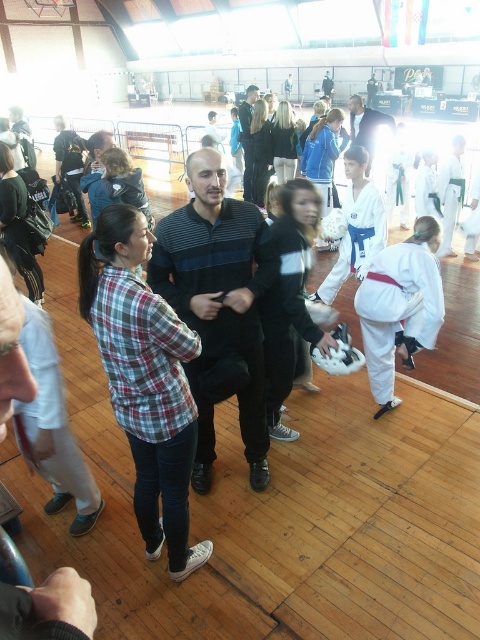
You are a photographer positioned at the back of the gymnasium. You want to take a photo that includes both the striped sweater at center and the matte black jacket at center. According to the scene, which object should you ensure is not blocking the other?

The striped sweater at center is in front of the matte black jacket at center, so you should ensure that the striped sweater at center is not blocking the matte black jacket at center.